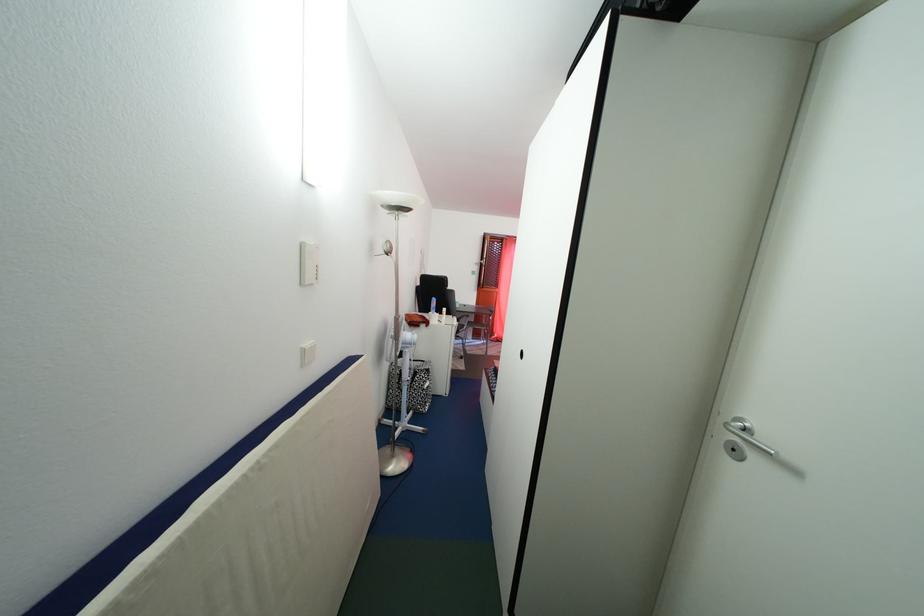
Where is `patterned wastebasket`? patterned wastebasket is located at coordinates (411, 387).